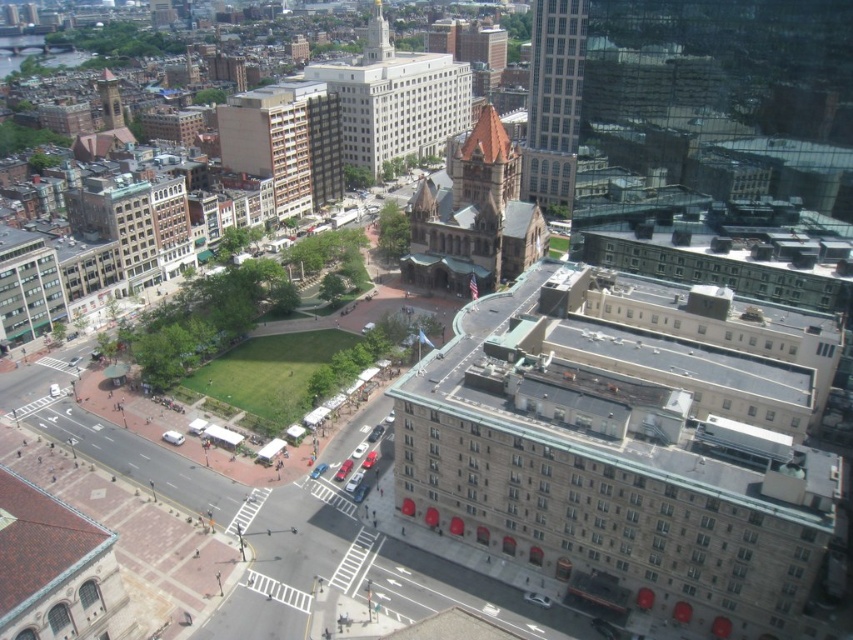
You are a city planner analyzing the urban layout. You need to determine which of the two buildings, the white stone building at center or the glassy reflective skyscraper at upper right, has a larger footprint to plan for future development. Which one should you prioritize?

The white stone building at center is bigger than the glassy reflective skyscraper at upper right, so you should prioritize the white stone building at center for future development due to its larger footprint.

You are a drone operator flying a drone over the city. You need to capture a photo of the historic building with the red roof. You have two points marked on your map, point 1 at coordinates (x=329, y=84) and point 2 at (x=372, y=20). Which point should you fly the drone to first to get a better view of the historic building?

Point 1 at coordinates (x=329, y=84) is closer to the camera, so flying the drone to point 1 first will provide a better view of the historic building with the red roof.

You are a city planner reviewing an urban map. You need to place a new emergency services station that must be equidistant from the white stone building at center and the nearest major road. Based on the coordinates provided, can you determine the best location for the station?

The white stone building at center is located at coordinates point (395, 100). To place the emergency services station equidistant from this building and the nearest major road, the station should be positioned along the perpendicular bisector of the line connecting the building and the road. However, without specific road coordinates, an exact point cannot be determined.